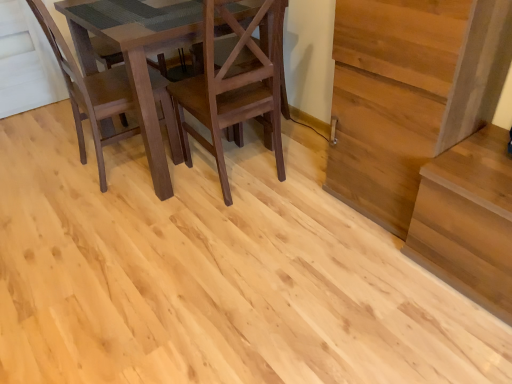
Question: Can you confirm if dark brown wood chair at left, which is the 2th chair in right-to-left order, is shorter than matte brown chair at center, acting as the second chair starting from the left?

Choices:
 (A) yes
 (B) no

Answer: (A)

Question: Could matte brown chair at center, which is the first chair in right-to-left order, be considered to be inside dark brown wood chair at left, which is the 1th chair from left to right?

Choices:
 (A) yes
 (B) no

Answer: (B)

Question: Can you confirm if dark brown wood chair at left, which is the 2th chair in right-to-left order, is positioned to the right of matte brown chair at center, acting as the second chair starting from the left?

Choices:
 (A) yes
 (B) no

Answer: (B)

Question: From a real-world perspective, does dark brown wood chair at left, which is the 1th chair from left to right, sit lower than matte brown chair at center, which is the first chair in right-to-left order?

Choices:
 (A) no
 (B) yes

Answer: (B)

Question: Is matte brown chair at center, acting as the second chair starting from the left, at the back of dark brown wood chair at left, which is the 2th chair in right-to-left order?

Choices:
 (A) no
 (B) yes

Answer: (A)

Question: Which is correct: light brown wood stairs at right is inside matte brown chair at center, which is the first chair in right-to-left order, or outside of it?

Choices:
 (A) inside
 (B) outside

Answer: (B)

Question: Based on their positions, is light brown wood stairs at right located to the left or right of matte brown chair at center, acting as the second chair starting from the left?

Choices:
 (A) right
 (B) left

Answer: (A)

Question: From a real-world perspective, is light brown wood stairs at right above or below matte brown chair at center, which is the first chair in right-to-left order?

Choices:
 (A) above
 (B) below

Answer: (A)

Question: Relative to matte brown chair at center, which is the first chair in right-to-left order, is light brown wood stairs at right in front or behind?

Choices:
 (A) behind
 (B) front

Answer: (B)

Question: In terms of size, does matte brown chair at center, acting as the second chair starting from the left, appear bigger or smaller than light brown wood stairs at right?

Choices:
 (A) big
 (B) small

Answer: (B)

Question: Would you say matte brown chair at center, acting as the second chair starting from the left, is to the left or to the right of light brown wood stairs at right in the picture?

Choices:
 (A) right
 (B) left

Answer: (B)

Question: From a real-world perspective, is matte brown chair at center, which is the first chair in right-to-left order, positioned above or below light brown wood stairs at right?

Choices:
 (A) above
 (B) below

Answer: (B)

Question: Does point (210, 117) appear closer or farther from the camera than point (479, 284)?

Choices:
 (A) farther
 (B) closer

Answer: (A)

Question: From a real-world perspective, relative to matte brown chair at center, which is the first chair in right-to-left order, is dark brown wood chair at left, which is the 2th chair in right-to-left order, vertically above or below?

Choices:
 (A) above
 (B) below

Answer: (B)

Question: Is dark brown wood chair at left, which is the 2th chair in right-to-left order, to the left or to the right of matte brown chair at center, which is the first chair in right-to-left order, in the image?

Choices:
 (A) right
 (B) left

Answer: (B)